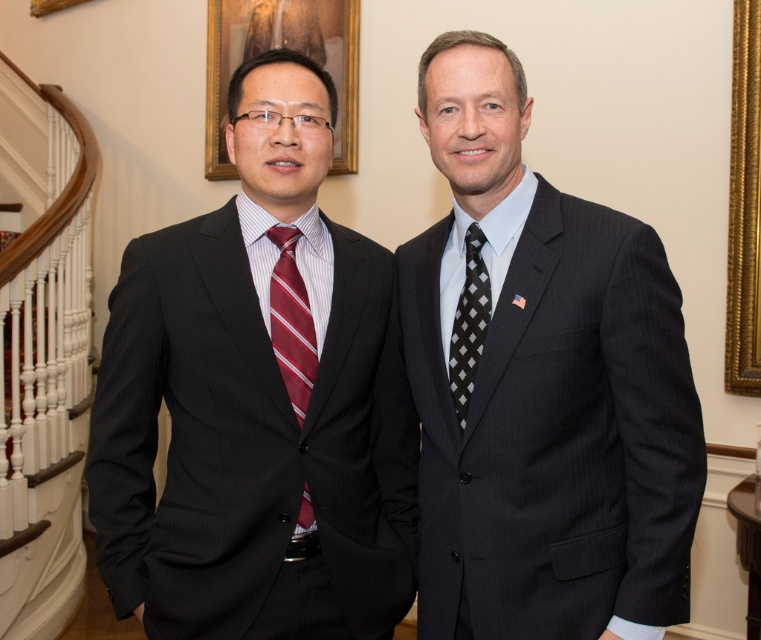
From the picture: You are an interior designer assessing the layout of this formal indoor space. You notice the black pinstripe suit at left and the matte gold picture frame at upper center. Which object is positioned higher in the image?

The matte gold picture frame at upper center is positioned higher than the black pinstripe suit at left.

You are a photographer setting up for a group photo. You need to arrange the black pinstripe suit at right and the striped silk tie at left so that both are visible in the frame. Given their heights, which person should you position closer to the camera to ensure their faces are clearly visible?

The black pinstripe suit at right is much taller than the striped silk tie at left. To ensure both faces are visible, position the striped silk tie at left closer to the camera so their face isn not obscured by the taller individual.